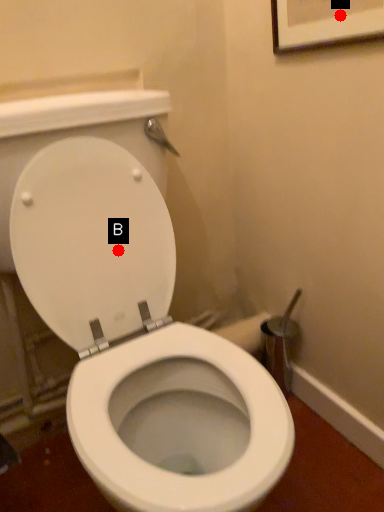
Question: Two points are circled on the image, labeled by A and B beside each circle. Which point is closer to the camera taking this photo?

Choices:
 (A) A is closer
 (B) B is closer

Answer: (A)